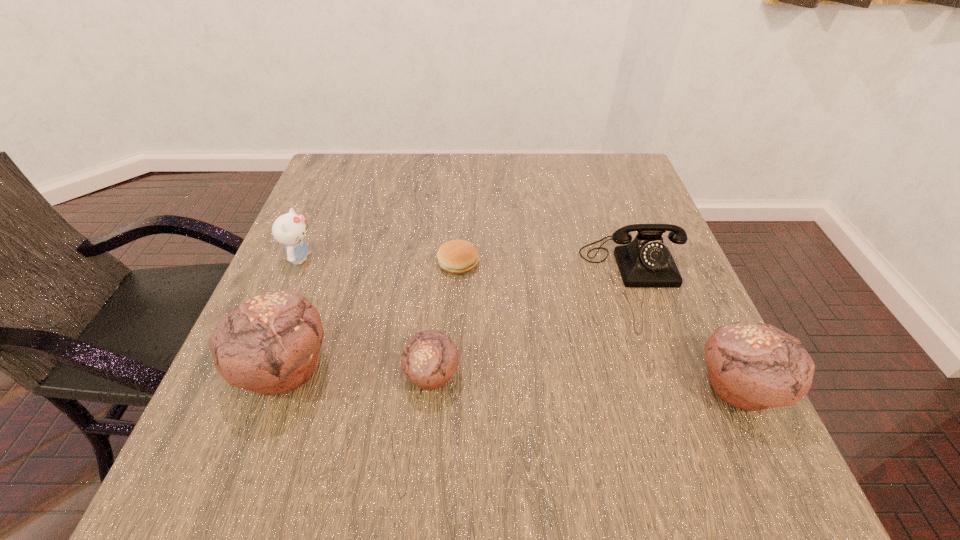
In the image, there is a desktop. Identify the location of vacant space at the left edge. This screenshot has width=960, height=540. (312, 267).

The image size is (960, 540). In the image, there is a desktop. What are the coordinates of `free space at the right edge` in the screenshot? It's located at (653, 361).

Identify the location of free point at the far left corner. The width and height of the screenshot is (960, 540). (339, 182).

This screenshot has width=960, height=540. In the image, there is a desktop. In order to click on vacant space at the near left corner in this screenshot , I will do `click(294, 392)`.

Identify the location of vacant space at the far right corner. The image size is (960, 540). (636, 190).

Find the location of a particular element. This screenshot has width=960, height=540. free area in between the shortest object and the second shortest muffin is located at coordinates (598, 326).

At what (x,y) coordinates should I click in order to perform the action: click on free spot between the shortest object and the leftmost muffin. Please return your answer as a coordinate pair (x, y). Image resolution: width=960 pixels, height=540 pixels. Looking at the image, I should click on (372, 315).

Identify the location of blank region between the shortest muffin and the leftmost muffin. (358, 372).

Find the location of `free point between the shortest object and the leftmost muffin`. free point between the shortest object and the leftmost muffin is located at coordinates (372, 315).

In order to click on unoccupied area between the shortest muffin and the leftmost muffin in this screenshot , I will do `click(358, 372)`.